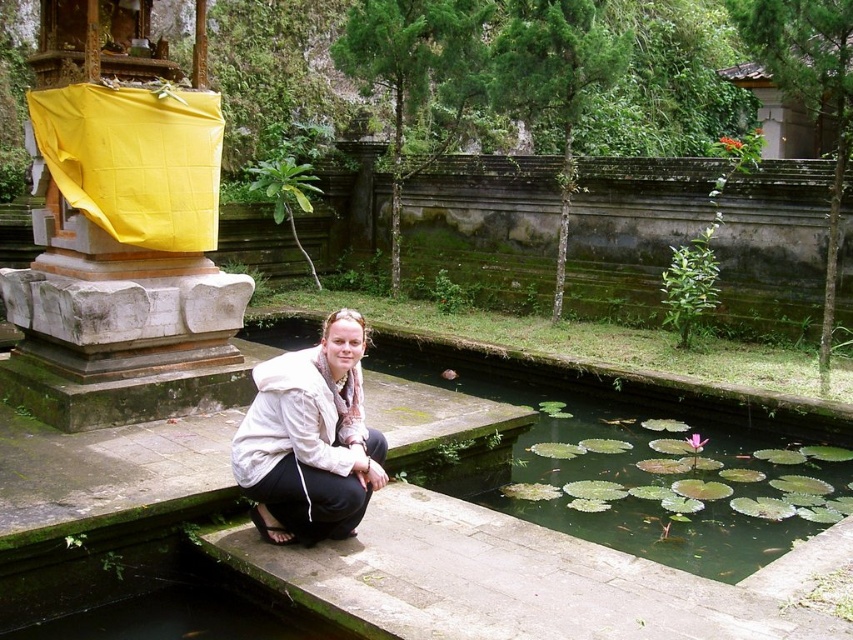
Question: Is the position of green lily pads at center less distant than that of white fabric at center?

Choices:
 (A) no
 (B) yes

Answer: (A)

Question: Is green lily pads at center above white fabric at center?

Choices:
 (A) no
 (B) yes

Answer: (B)

Question: Does green lily pads at center come in front of white fabric at center?

Choices:
 (A) yes
 (B) no

Answer: (B)

Question: Which of the following is the closest to the observer?

Choices:
 (A) (335, 346)
 (B) (775, 483)

Answer: (A)

Question: Which point is farther from the camera taking this photo?

Choices:
 (A) (479, 349)
 (B) (306, 483)

Answer: (A)